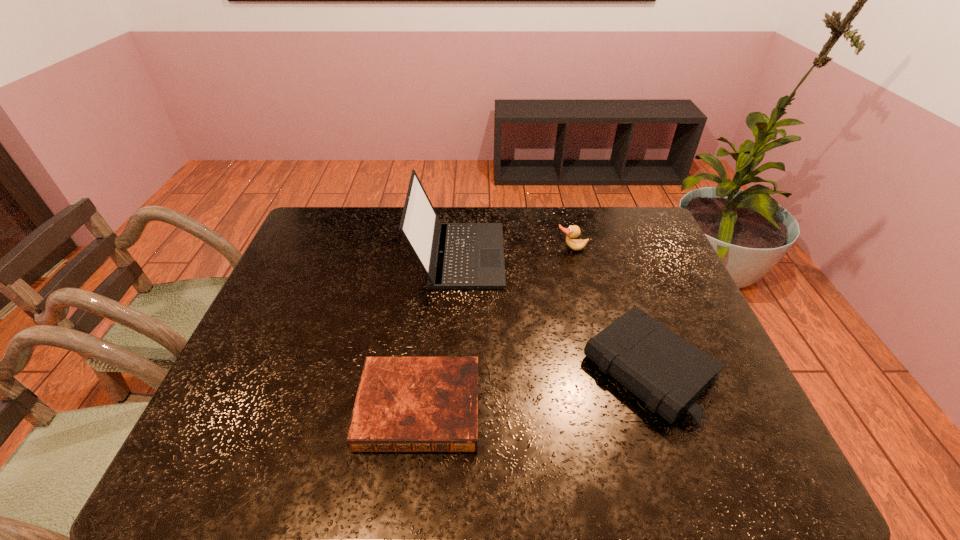
Identify the location of duck that is at the far edge. (573, 231).

Locate an element on the screen. object present at the near edge is located at coordinates (403, 404).

This screenshot has height=540, width=960. I want to click on object at the right edge, so click(x=666, y=372).

Where is `free space at the far edge of the desktop`? The image size is (960, 540). free space at the far edge of the desktop is located at coordinates (528, 227).

Image resolution: width=960 pixels, height=540 pixels. I want to click on free space at the near edge of the desktop, so click(570, 459).

Locate an element on the screen. The height and width of the screenshot is (540, 960). vacant space at the left edge of the desktop is located at coordinates (243, 409).

This screenshot has width=960, height=540. I want to click on vacant space at the right edge of the desktop, so click(x=644, y=308).

Locate an element on the screen. Image resolution: width=960 pixels, height=540 pixels. free space at the far left corner of the desktop is located at coordinates (327, 234).

The height and width of the screenshot is (540, 960). In order to click on free space at the near left corner of the desktop in this screenshot , I will do `click(264, 440)`.

The image size is (960, 540). Find the location of `vacant region at the far right corner of the desktop`. vacant region at the far right corner of the desktop is located at coordinates (633, 221).